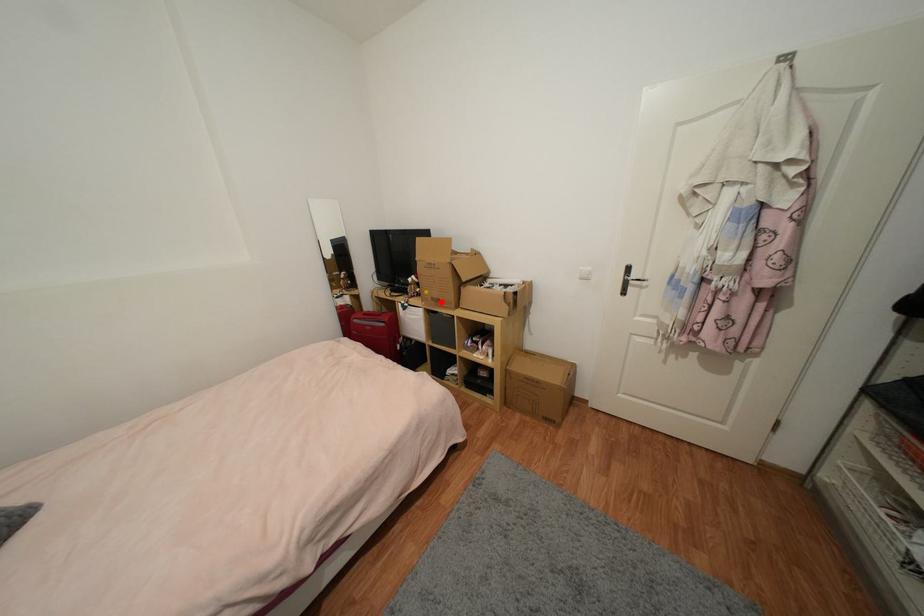
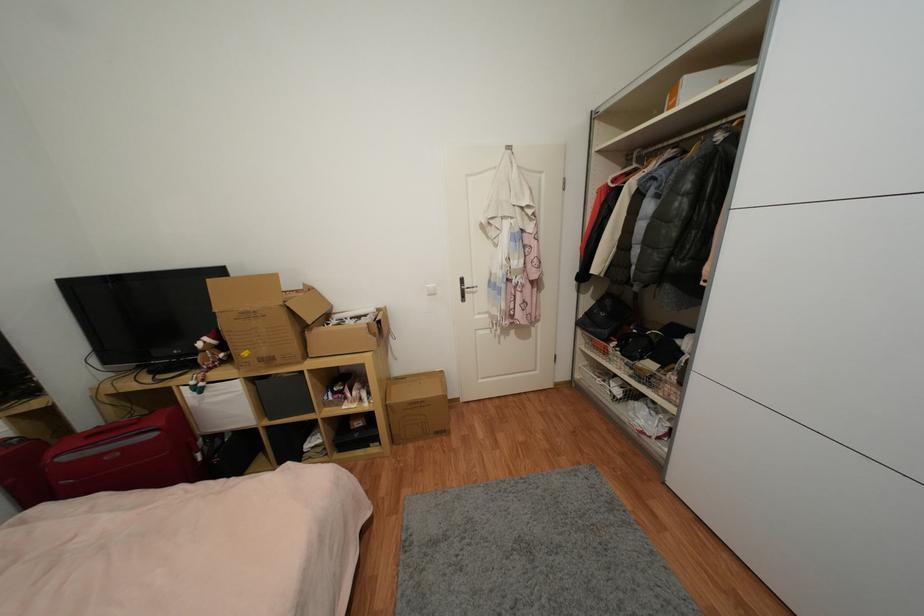
Find the pixel in the second image that matches the highlighted location in the first image.

(274, 361)